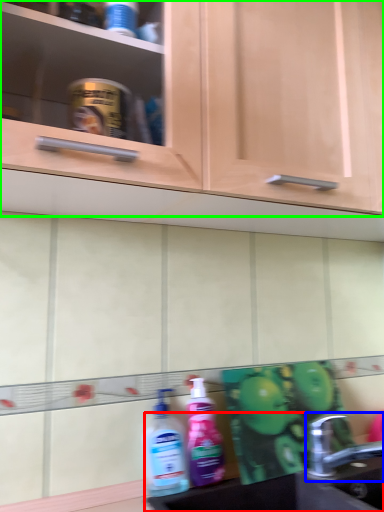
Question: Which object is positioned farthest from sink (highlighted by a red box)? Select from tap (highlighted by a blue box) and cabinetry (highlighted by a green box).

Choices:
 (A) tap
 (B) cabinetry

Answer: (B)